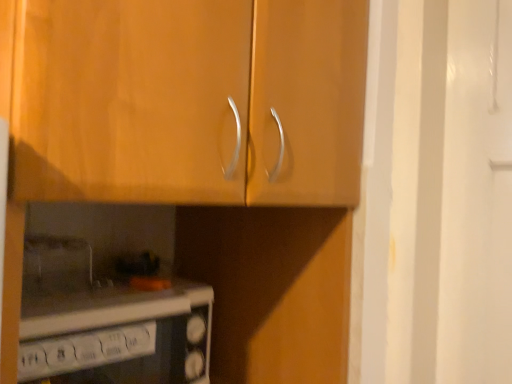
Image resolution: width=512 pixels, height=384 pixels. Describe the element at coordinates (118, 337) in the screenshot. I see `white glossy microwave at lower left` at that location.

Locate an element on the screen. white glossy microwave at lower left is located at coordinates (118, 337).

Describe the element at coordinates (202, 154) in the screenshot. This screenshot has height=384, width=512. I see `wooden cabinet at upper center` at that location.

What are the coordinates of `wooden cabinet at upper center` in the screenshot? It's located at (202, 154).

This screenshot has height=384, width=512. I want to click on white glossy microwave at lower left, so click(118, 337).

Considering the positions of objects wooden cabinet at upper center and white glossy microwave at lower left in the image provided, who is more to the left, wooden cabinet at upper center or white glossy microwave at lower left?

white glossy microwave at lower left is more to the left.

Considering their positions, is wooden cabinet at upper center located in front of or behind white glossy microwave at lower left?

Visually, wooden cabinet at upper center is located in front of white glossy microwave at lower left.

Is point (258, 365) closer or farther from the camera than point (151, 362)?

Point (258, 365) is farther from the camera than point (151, 362).

From the image's perspective, is wooden cabinet at upper center positioned above or below white glossy microwave at lower left?

Based on their image positions, wooden cabinet at upper center is located above white glossy microwave at lower left.

From a real-world perspective, is wooden cabinet at upper center positioned under white glossy microwave at lower left based on gravity?

No.

In terms of width, does wooden cabinet at upper center look wider or thinner when compared to white glossy microwave at lower left?

Clearly, wooden cabinet at upper center has more width compared to white glossy microwave at lower left.

From the picture: Which of these two, wooden cabinet at upper center or white glossy microwave at lower left, stands taller?

wooden cabinet at upper center is taller.

Does wooden cabinet at upper center have a smaller size compared to white glossy microwave at lower left?

No.

Is white glossy microwave at lower left completely or partially inside wooden cabinet at upper center?

That's incorrect, white glossy microwave at lower left is not inside wooden cabinet at upper center.

Are wooden cabinet at upper center and white glossy microwave at lower left far apart?

Actually, wooden cabinet at upper center and white glossy microwave at lower left are a little close together.

Is wooden cabinet at upper center oriented away from white glossy microwave at lower left?

No, wooden cabinet at upper center's orientation is not away from white glossy microwave at lower left.

Can you tell me how much wooden cabinet at upper center and white glossy microwave at lower left differ in facing direction?

They differ by 4.08 degrees in their facing directions.

I want to click on home appliance that is under the wooden cabinet at upper center (from a real-world perspective), so click(x=118, y=337).

Based on their positions, is white glossy microwave at lower left located to the left or right of wooden cabinet at upper center?

In the image, white glossy microwave at lower left appears on the left side of wooden cabinet at upper center.

Who is more distant, white glossy microwave at lower left or wooden cabinet at upper center?

Positioned behind is white glossy microwave at lower left.

Which point is more distant from viewer, (145, 321) or (325, 41)?

Positioned behind is point (145, 321).

From the image's perspective, which is above, white glossy microwave at lower left or wooden cabinet at upper center?

wooden cabinet at upper center appears higher in the image.

From a real-world perspective, is white glossy microwave at lower left positioned above or below wooden cabinet at upper center?

white glossy microwave at lower left is situated lower than wooden cabinet at upper center in the real world.

Looking at their sizes, would you say white glossy microwave at lower left is wider or thinner than wooden cabinet at upper center?

In the image, white glossy microwave at lower left appears to be more narrow than wooden cabinet at upper center.

From their relative heights in the image, would you say white glossy microwave at lower left is taller or shorter than wooden cabinet at upper center?

Clearly, white glossy microwave at lower left is shorter compared to wooden cabinet at upper center.

Which of these two, white glossy microwave at lower left or wooden cabinet at upper center, is smaller?

white glossy microwave at lower left is smaller.

Is white glossy microwave at lower left inside or outside of wooden cabinet at upper center?

white glossy microwave at lower left is not inside wooden cabinet at upper center, it's outside.

Would you say white glossy microwave at lower left is a long distance from wooden cabinet at upper center?

Actually, white glossy microwave at lower left and wooden cabinet at upper center are a little close together.

Is white glossy microwave at lower left turned away from wooden cabinet at upper center?

No, white glossy microwave at lower left is not facing the opposite direction of wooden cabinet at upper center.

Identify the location of home appliance located below the wooden cabinet at upper center (from the image's perspective). The width and height of the screenshot is (512, 384). (118, 337).

You are a GUI agent. You are given a task and a screenshot of the screen. Output one action in this format:
    pyautogui.click(x=<x>, y=<y>)
    Task: Click on the home appliance that is below the wooden cabinet at upper center (from the image's perspective)
    This screenshot has height=384, width=512.
    Given the screenshot: What is the action you would take?
    pyautogui.click(x=118, y=337)

Identify the location of cabinetry in front of the white glossy microwave at lower left. (202, 154).